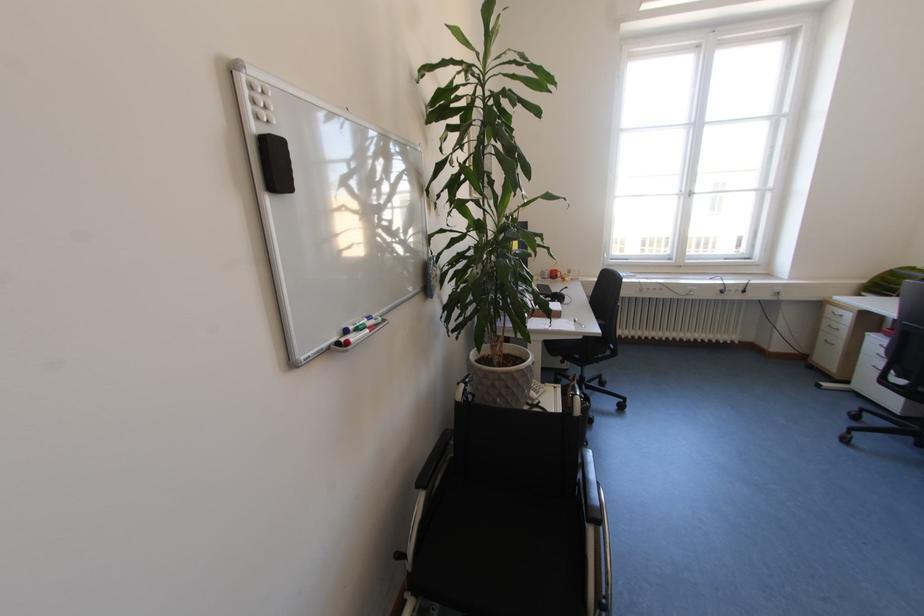
You are a GUI agent. You are given a task and a screenshot of the screen. Output one action in this format:
    pyautogui.click(x=<x>, y=<y>)
    Task: Click on the white window handle
    The width and height of the screenshot is (924, 616).
    Given the screenshot: What is the action you would take?
    pyautogui.click(x=688, y=193)